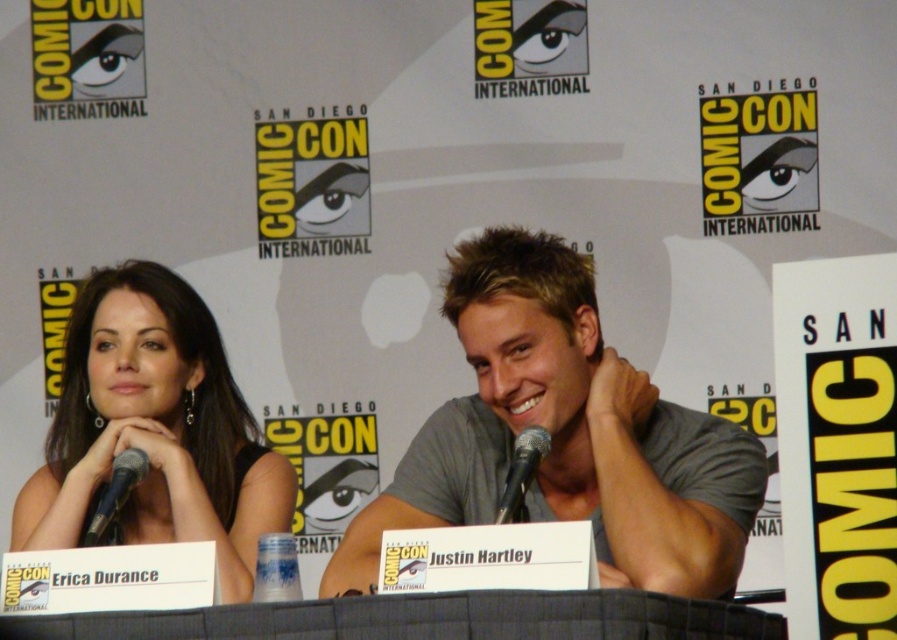
Does gray cotton shirt at center have a lesser width compared to matte black dress at left?

In fact, gray cotton shirt at center might be wider than matte black dress at left.

Does gray cotton shirt at center have a lesser height compared to matte black dress at left?

No, gray cotton shirt at center is not shorter than matte black dress at left.

This screenshot has width=897, height=640. What do you see at coordinates (565, 435) in the screenshot? I see `gray cotton shirt at center` at bounding box center [565, 435].

In order to click on gray cotton shirt at center in this screenshot , I will do `click(565, 435)`.

Does black metallic microphone at center have a larger size compared to black metallic microphone at left?

A: No, black metallic microphone at center is not bigger than black metallic microphone at left.

Is black metallic microphone at center further to the viewer compared to black metallic microphone at left?

No.

In order to click on black metallic microphone at center in this screenshot , I will do `click(521, 472)`.

Where is `black metallic microphone at center`? black metallic microphone at center is located at coordinates (521, 472).

Between gray cotton shirt at center and black metallic microphone at center, which one is positioned higher?

gray cotton shirt at center is above.

Who is more forward, (601, 525) or (521, 460)?

Point (521, 460) is more forward.

What are the coordinates of `gray cotton shirt at center` in the screenshot? It's located at (565, 435).